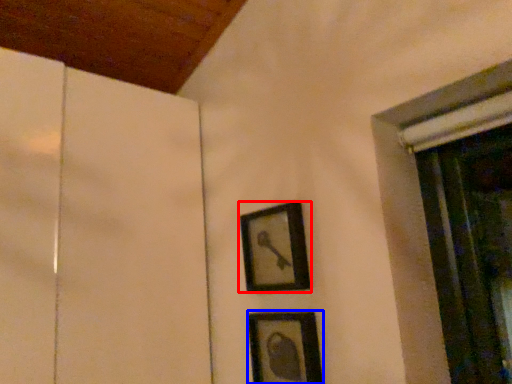
Question: Which of the following is the closest to the observer, picture frame (highlighted by a red box) or picture frame (highlighted by a blue box)?

Choices:
 (A) picture frame
 (B) picture frame

Answer: (B)